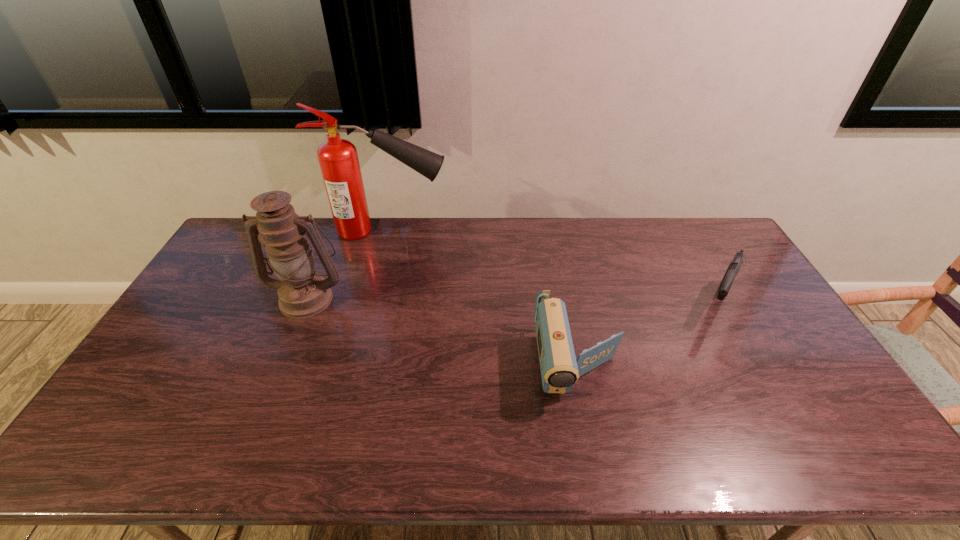
Where is `object that is at the right edge`? object that is at the right edge is located at coordinates click(x=726, y=283).

At what (x,y) coordinates should I click in order to perform the action: click on vacant point at the far edge. Please return your answer as a coordinate pair (x, y). This screenshot has height=540, width=960. Looking at the image, I should click on (612, 239).

In the image, there is a desktop. At what (x,y) coordinates should I click in order to perform the action: click on free space at the near edge. Please return your answer as a coordinate pair (x, y). Image resolution: width=960 pixels, height=540 pixels. Looking at the image, I should click on (188, 446).

At what (x,y) coordinates should I click in order to perform the action: click on free region at the left edge of the desktop. Please return your answer as a coordinate pair (x, y). This screenshot has height=540, width=960. Looking at the image, I should click on (184, 357).

Find the location of a particular element. The height and width of the screenshot is (540, 960). vacant space at the right edge is located at coordinates (769, 315).

Where is `blank area at the near left corner`? This screenshot has width=960, height=540. blank area at the near left corner is located at coordinates (92, 446).

Locate an element on the screen. unoccupied position between the rightmost object and the camcorder is located at coordinates (647, 334).

I want to click on free area in between the farthest object and the camcorder, so click(x=482, y=298).

You are a GUI agent. You are given a task and a screenshot of the screen. Output one action in this format:
    pyautogui.click(x=<x>, y=<y>)
    Task: Click on the vacant point located between the second tallest object and the tallest object
    The image size is (960, 540).
    Given the screenshot: What is the action you would take?
    pyautogui.click(x=347, y=264)

You are a GUI agent. You are given a task and a screenshot of the screen. Output one action in this format:
    pyautogui.click(x=<x>, y=<y>)
    Task: Click on the vacant region between the fire extinguisher and the camcorder
    
    Given the screenshot: What is the action you would take?
    pyautogui.click(x=482, y=298)